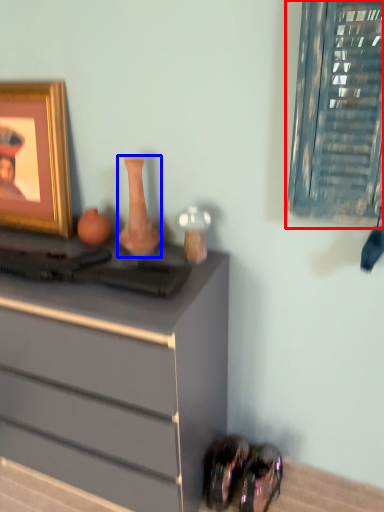
Question: Which of the following is the closest to the observer, window (highlighted by a red box) or vase (highlighted by a blue box)?

Choices:
 (A) window
 (B) vase

Answer: (A)